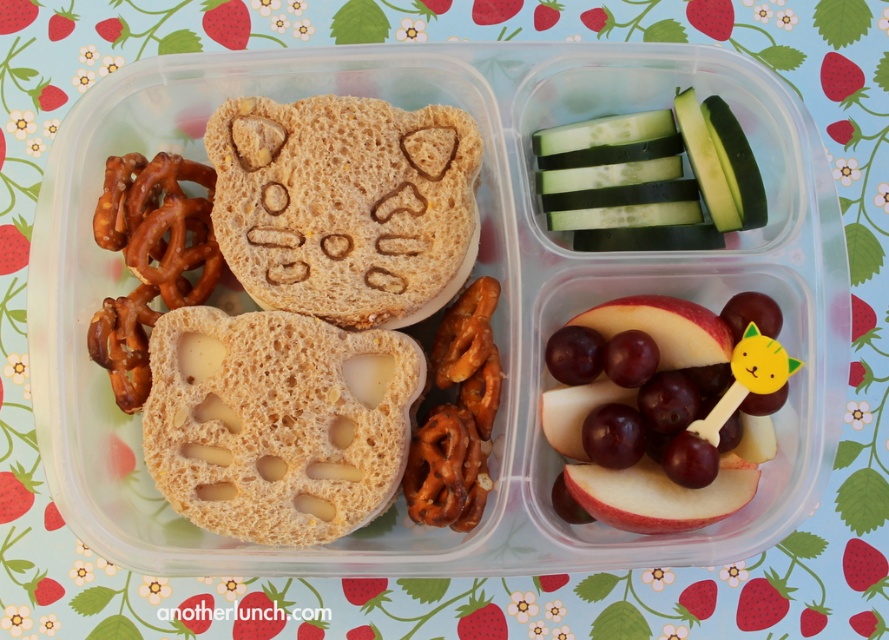
Question: Can you confirm if red matte apple at center is positioned to the right of brown crunchy pretzel at left?

Choices:
 (A) yes
 (B) no

Answer: (A)

Question: Which object is farther from the camera taking this photo?

Choices:
 (A) crispy golden pretzel at center
 (B) brown crunchy pretzel at left
 (C) green smooth cucumber at upper right

Answer: (C)

Question: Among these objects, which one is nearest to the camera?

Choices:
 (A) red matte apple at center
 (B) brown porous bread at center

Answer: (A)

Question: Which object is closer to the camera taking this photo?

Choices:
 (A) peanut butter sandwich at left
 (B) brown crunchy pretzel at left
 (C) red matte apple at center

Answer: (C)

Question: From the image, what is the correct spatial relationship of green smooth cucumber at upper right in relation to brown crunchy pretzel at left?

Choices:
 (A) above
 (B) below

Answer: (A)

Question: Considering the relative positions of brown textured bear-shaped sandwich at center and brown crunchy pretzel at left in the image provided, where is brown textured bear-shaped sandwich at center located with respect to brown crunchy pretzel at left?

Choices:
 (A) left
 (B) right

Answer: (B)